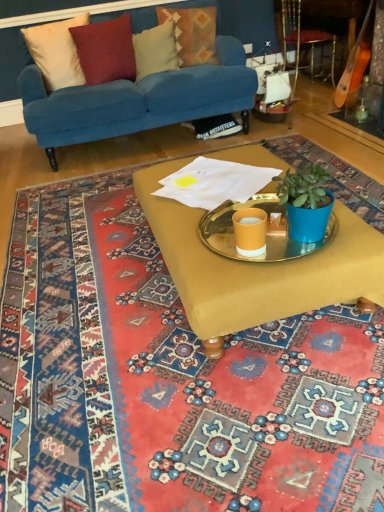
Identify the location of vacant region to the left of matte gold coffee table at center. The width and height of the screenshot is (384, 512). (85, 292).